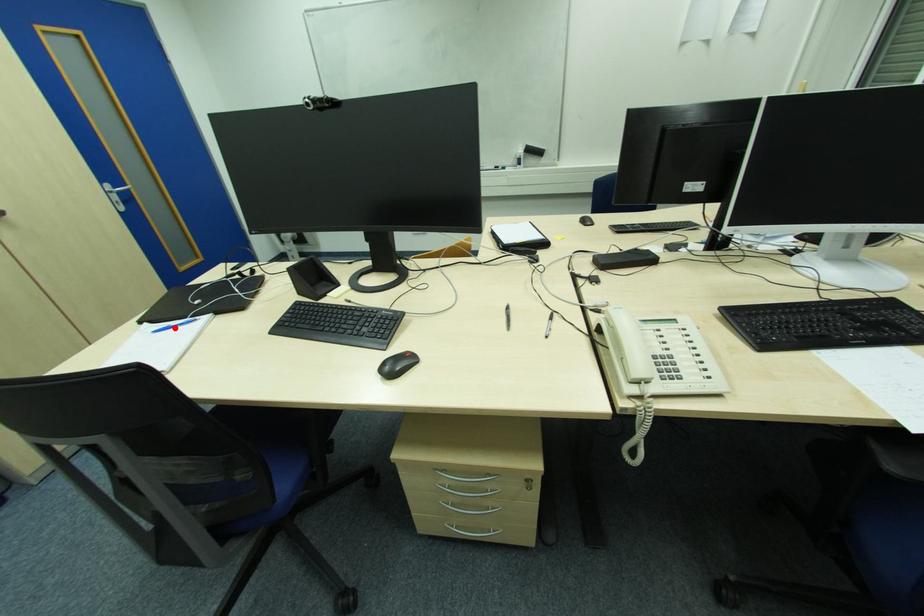
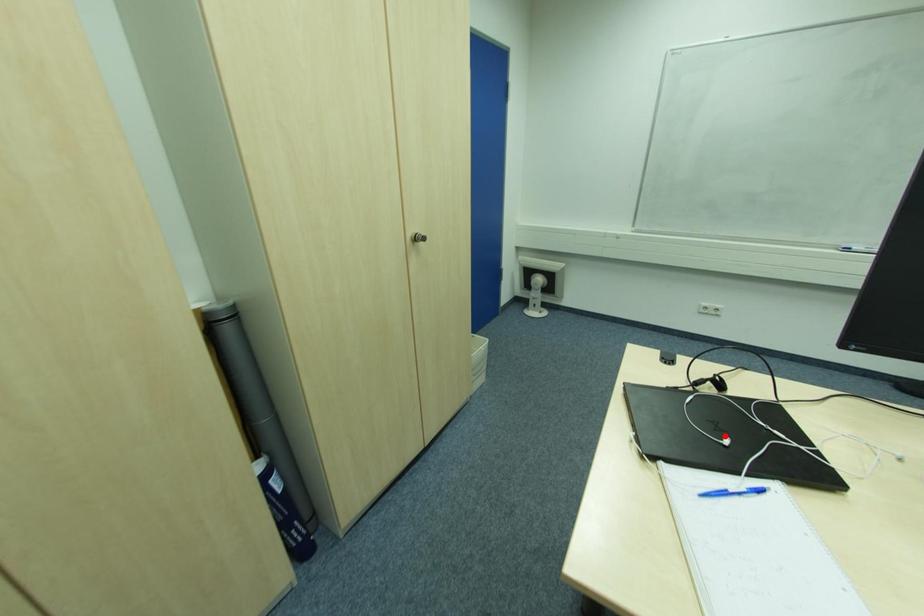
I am providing you with two images of the same scene from different viewpoints. A red point is marked on the first image and another point is marked on the second image. Are the points marked in image1 and image2 representing the same 3D position?

No